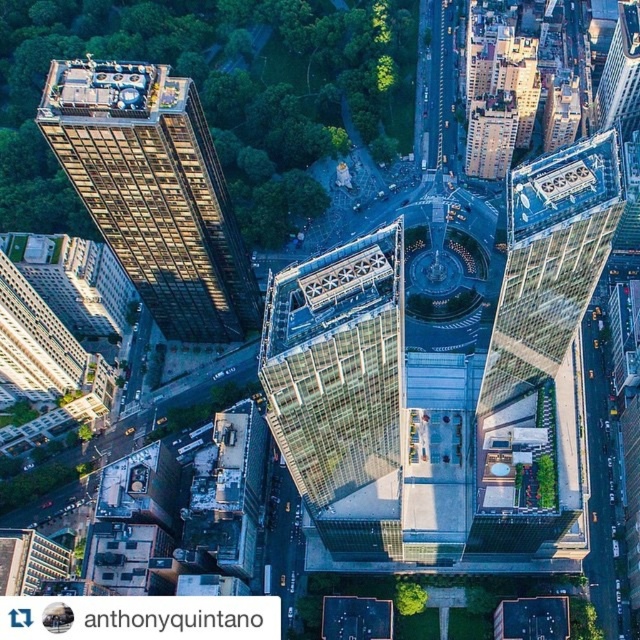
Question: Is dark brown glass skyscraper at left thinner than transparent glass skyscraper at center?

Choices:
 (A) yes
 (B) no

Answer: (B)

Question: Which point appears farthest from the camera in this image?

Choices:
 (A) (x=198, y=280)
 (B) (x=314, y=419)

Answer: (A)

Question: Does dark brown glass skyscraper at left appear on the left side of transparent glass skyscraper at center?

Choices:
 (A) yes
 (B) no

Answer: (A)

Question: Can you confirm if dark brown glass skyscraper at left is positioned to the left of transparent glass skyscraper at center?

Choices:
 (A) no
 (B) yes

Answer: (B)

Question: Which point is farther from the camera taking this photo?

Choices:
 (A) (284, 452)
 (B) (97, 193)

Answer: (B)

Question: Which object appears farthest from the camera in this image?

Choices:
 (A) dark brown glass skyscraper at left
 (B) transparent glass skyscraper at center

Answer: (A)